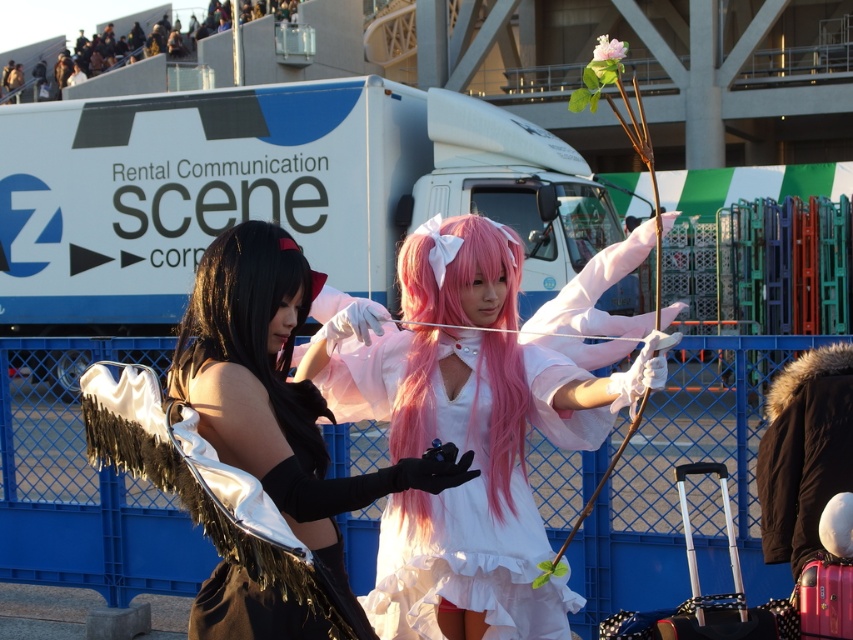
Question: Is white satin dress at center positioned before black silky hair at left?

Choices:
 (A) no
 (B) yes

Answer: (A)

Question: Can you confirm if black silky hair at left is smaller than black fur coat at right?

Choices:
 (A) no
 (B) yes

Answer: (B)

Question: Which point appears closest to the camera in this image?

Choices:
 (A) (171, 417)
 (B) (392, 378)
 (C) (273, 376)
 (D) (763, 540)

Answer: (A)

Question: Which object is the closest to the black silky hair at left?

Choices:
 (A) white satin dress at center
 (B) satin-like white wings at center

Answer: (B)

Question: Estimate the real-world distances between objects in this image. Which object is farther from the black fur coat at right?

Choices:
 (A) white satin dress at center
 (B) pink silky hair at center
 (C) black silky hair at left
 (D) satin-like white wings at center

Answer: (D)

Question: Does white satin dress at center appear on the left side of pink silky hair at center?

Choices:
 (A) yes
 (B) no

Answer: (B)